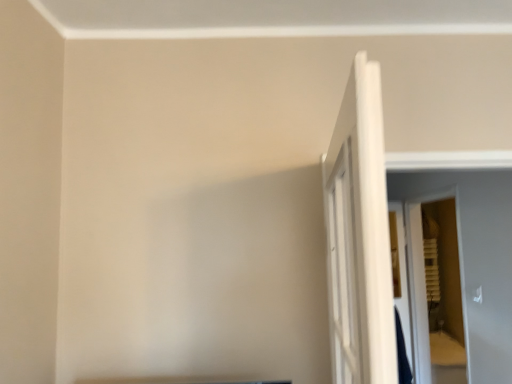
What are the coordinates of `white wooden door at right` in the screenshot? It's located at (359, 236).

What do you see at coordinates (359, 236) in the screenshot? I see `white wooden door at right` at bounding box center [359, 236].

What is the approximate height of white wooden screen door at right?

white wooden screen door at right is 1.30 meters tall.

What is the approximate width of white wooden screen door at right?

It is 6.51 inches.

You are a GUI agent. You are given a task and a screenshot of the screen. Output one action in this format:
    pyautogui.click(x=<x>, y=<y>)
    Task: Click on the white wooden screen door at right
    
    Given the screenshot: What is the action you would take?
    pyautogui.click(x=419, y=284)

The height and width of the screenshot is (384, 512). Describe the element at coordinates (419, 284) in the screenshot. I see `white wooden screen door at right` at that location.

Where is `white wooden door at right`? The height and width of the screenshot is (384, 512). white wooden door at right is located at coordinates (359, 236).

Between white wooden screen door at right and white wooden door at right, which one appears on the left side from the viewer's perspective?

white wooden door at right is more to the left.

Considering the positions of objects white wooden screen door at right and white wooden door at right in the image provided, who is in front, white wooden screen door at right or white wooden door at right?

white wooden door at right.

Which is behind, point (414, 336) or point (364, 197)?

The point (414, 336) is more distant.

From the image's perspective, is white wooden screen door at right on top of white wooden door at right?

No.

From a real-world perspective, is white wooden screen door at right positioned over white wooden door at right based on gravity?

Actually, white wooden screen door at right is physically below white wooden door at right in the real world.

Does white wooden screen door at right have a lesser width compared to white wooden door at right?

In fact, white wooden screen door at right might be wider than white wooden door at right.

Is white wooden screen door at right taller or shorter than white wooden door at right?

Considering their sizes, white wooden screen door at right has more height than white wooden door at right.

Who is bigger, white wooden screen door at right or white wooden door at right?

→ With larger size is white wooden screen door at right.

In the scene shown: Would you say white wooden screen door at right is outside white wooden door at right?

Yes.

Is white wooden screen door at right next to white wooden door at right?

No, white wooden screen door at right is not with white wooden door at right.

Is white wooden door at right at the back of white wooden screen door at right?

No, white wooden screen door at right's orientation is not away from white wooden door at right.

What's the angular difference between white wooden screen door at right and white wooden door at right's facing directions?

173 degrees.

In order to click on screen door below the white wooden door at right (from the image's perspective) in this screenshot , I will do `click(419, 284)`.

Does white wooden door at right appear on the left side of white wooden screen door at right?

Yes.

Considering their positions, is white wooden door at right located in front of or behind white wooden screen door at right?

white wooden door at right is positioned closer to the viewer than white wooden screen door at right.

Considering the positions of point (342, 332) and point (460, 291), is point (342, 332) closer or farther from the camera than point (460, 291)?

Clearly, point (342, 332) is closer to the camera than point (460, 291).

From the image's perspective, which is above, white wooden door at right or white wooden screen door at right?

white wooden door at right is shown above in the image.

From a real-world perspective, between white wooden door at right and white wooden screen door at right, who is vertically lower?

In real-world perspective, white wooden screen door at right is lower.

Between white wooden door at right and white wooden screen door at right, which one has smaller width?

white wooden door at right.

In terms of height, does white wooden door at right look taller or shorter compared to white wooden screen door at right?

In the image, white wooden door at right appears to be shorter than white wooden screen door at right.

Looking at the image, does white wooden door at right seem bigger or smaller compared to white wooden screen door at right?

white wooden door at right is smaller than white wooden screen door at right.

Is white wooden door at right inside the boundaries of white wooden screen door at right, or outside?

white wooden door at right cannot be found inside white wooden screen door at right.

Is there a large distance between white wooden door at right and white wooden screen door at right?

white wooden door at right is positioned a significant distance from white wooden screen door at right.

Does white wooden door at right turn towards white wooden screen door at right?

No, white wooden door at right is not oriented towards white wooden screen door at right.

The height and width of the screenshot is (384, 512). Find the location of `screen door lying on the right of white wooden door at right`. screen door lying on the right of white wooden door at right is located at coordinates (419, 284).

Find the location of a particular element. The height and width of the screenshot is (384, 512). screen door behind the white wooden door at right is located at coordinates (419, 284).

Find the location of `door above the white wooden screen door at right (from a real-world perspective)`. door above the white wooden screen door at right (from a real-world perspective) is located at coordinates (359, 236).